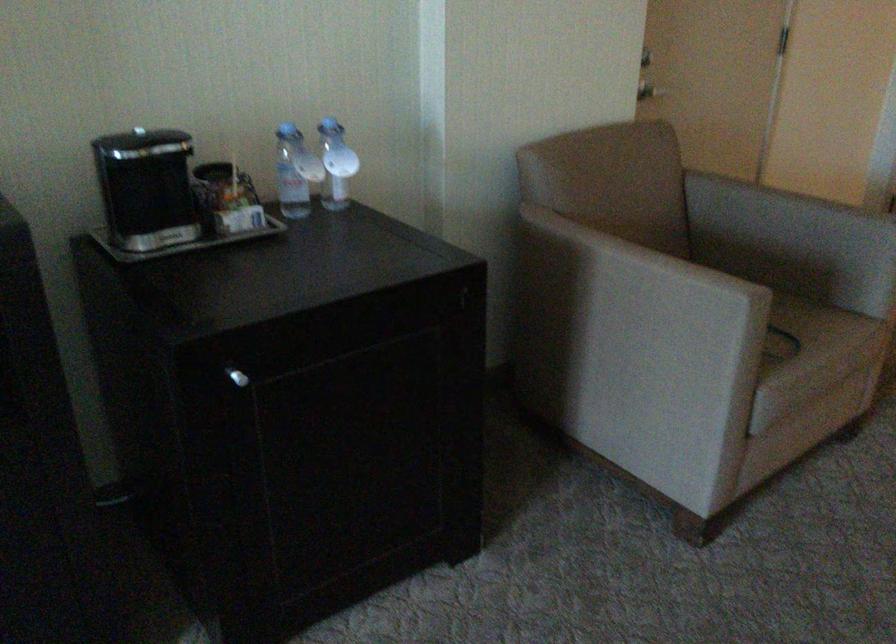
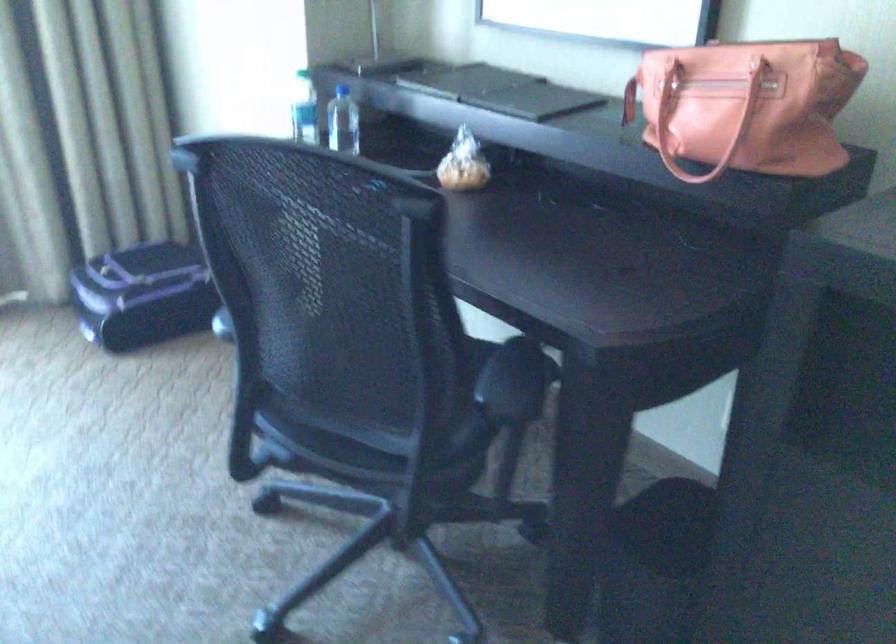
How did the camera likely rotate?

The camera rotated toward left-down.